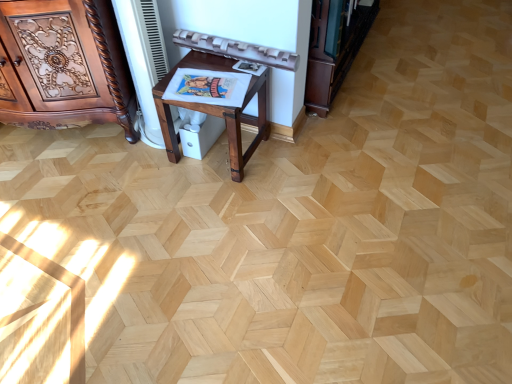
Where is `vacant area located to the right-hand side of dark brown wood bookshelf at upper right`? vacant area located to the right-hand side of dark brown wood bookshelf at upper right is located at coordinates (383, 86).